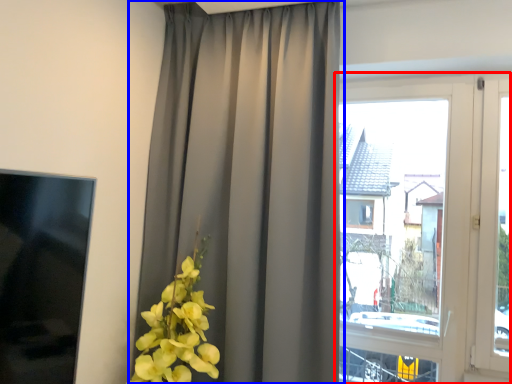
Question: Among these objects, which one is farthest to the camera, window (highlighted by a red box) or curtain (highlighted by a blue box)?

Choices:
 (A) window
 (B) curtain

Answer: (A)